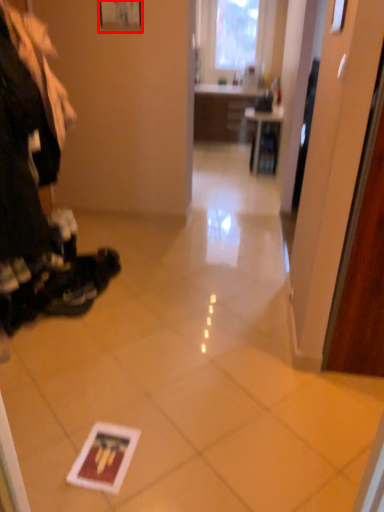
Question: Considering the relative positions of picture frame (annotated by the red box) and table in the image provided, where is picture frame (annotated by the red box) located with respect to the staircase?

Choices:
 (A) right
 (B) left

Answer: (B)